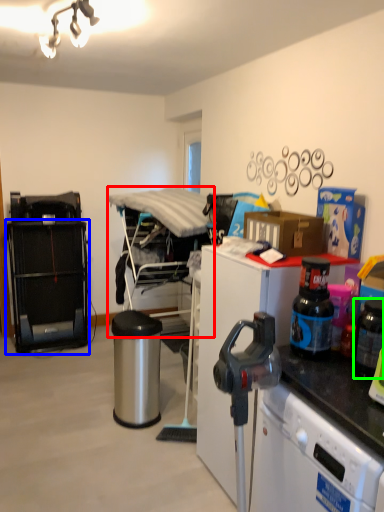
Question: Which object is positioned closest to furniture (highlighted by a red box)? Select from cabinetry (highlighted by a blue box) and appliance (highlighted by a green box).

Choices:
 (A) cabinetry
 (B) appliance

Answer: (A)